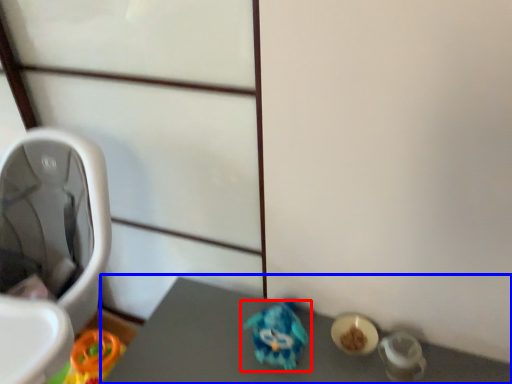
Question: Which object appears closest to the camera in this image, toy (highlighted by a red box) or vanity (highlighted by a blue box)?

Choices:
 (A) toy
 (B) vanity

Answer: (B)